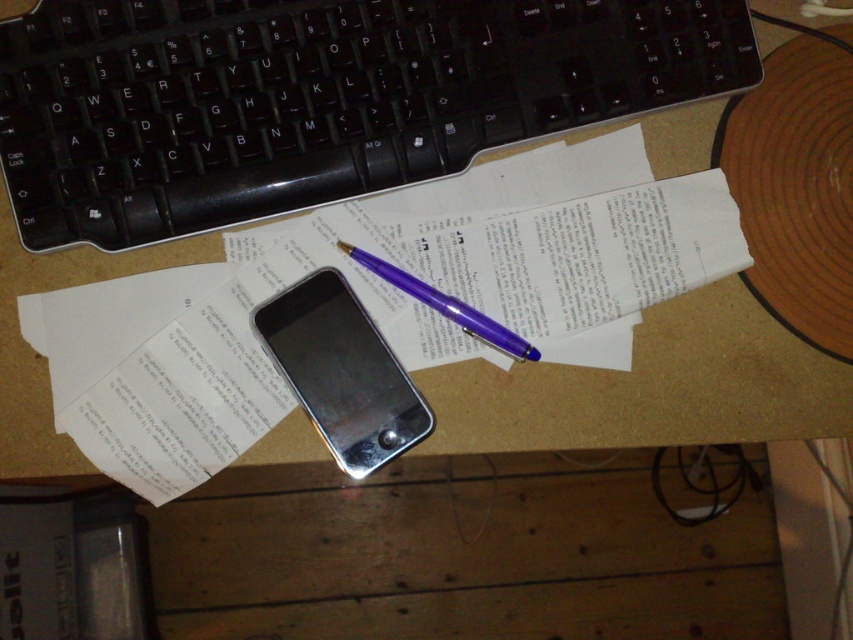
Who is more forward, [334,74] or [607,332]?

Point [334,74] is more forward.

Can you confirm if black plastic keyboard at upper center is positioned above white paper at center?

Yes.

Is point (276, 188) farther from viewer compared to point (144, 337)?

That is False.

At what (x,y) coordinates should I click in order to perform the action: click on black plastic keyboard at upper center. Please return your answer as a coordinate pair (x, y). Looking at the image, I should click on (317, 97).

From the picture: Can you confirm if white paper at center is smaller than purple glossy pen at center?

No, white paper at center is not smaller than purple glossy pen at center.

The height and width of the screenshot is (640, 853). I want to click on white paper at center, so click(x=381, y=300).

Can you confirm if silver metallic smartphone at center is positioned above purple glossy pen at center?

No.

Describe the element at coordinates (341, 372) in the screenshot. The width and height of the screenshot is (853, 640). I see `silver metallic smartphone at center` at that location.

The image size is (853, 640). What do you see at coordinates (341, 372) in the screenshot?
I see `silver metallic smartphone at center` at bounding box center [341, 372].

Find the location of a particular element. The image size is (853, 640). silver metallic smartphone at center is located at coordinates 341,372.